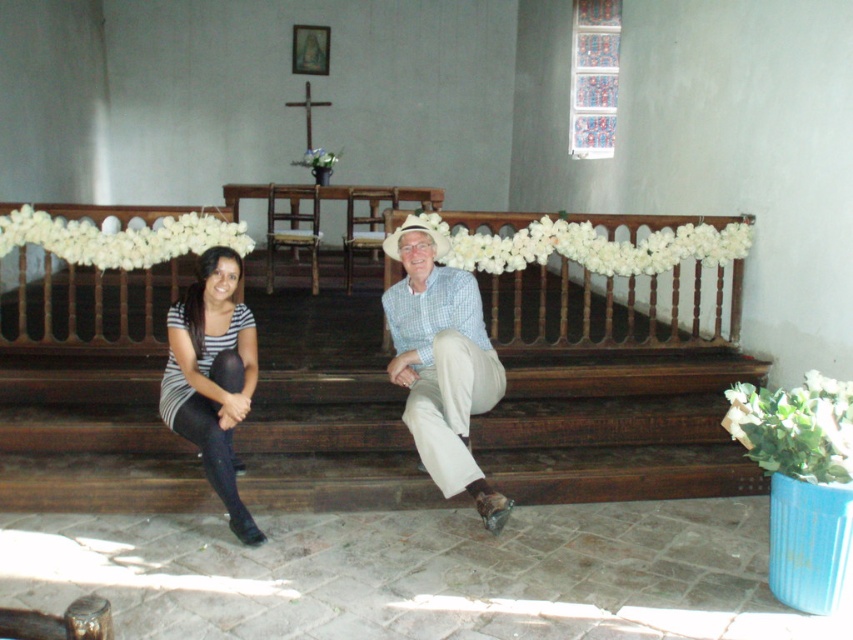
Question: Is striped fabric shirt at center further to the viewer compared to striped fabric dress at left?

Choices:
 (A) no
 (B) yes

Answer: (B)

Question: Does light blue checkered shirt at center have a smaller size compared to white fabric garland at center?

Choices:
 (A) no
 (B) yes

Answer: (A)

Question: Which point is closer to the camera?

Choices:
 (A) green leafy plant at lower right
 (B) striped fabric dress at left

Answer: (A)

Question: Estimate the real-world distances between objects in this image. Which object is closer to the white fabric garland at center?

Choices:
 (A) white floral garland at center
 (B) striped fabric dress at left

Answer: (B)

Question: Does striped fabric dress at left have a lesser width compared to green leafy plant at lower right?

Choices:
 (A) yes
 (B) no

Answer: (B)

Question: Which of these objects is positioned closest to the white floral garland at center?

Choices:
 (A) striped fabric shirt at center
 (B) striped fabric dress at left
 (C) light blue checkered shirt at center

Answer: (B)